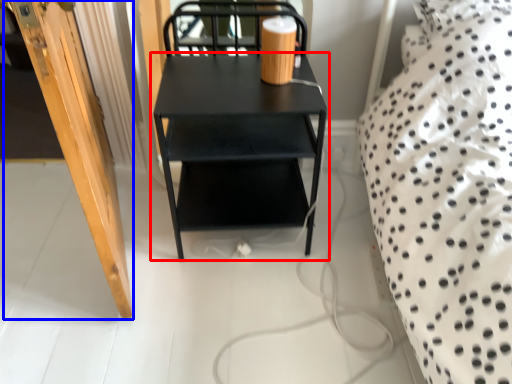
Question: Which object is closer to the camera taking this photo, table (highlighted by a red box) or door (highlighted by a blue box)?

Choices:
 (A) table
 (B) door

Answer: (B)